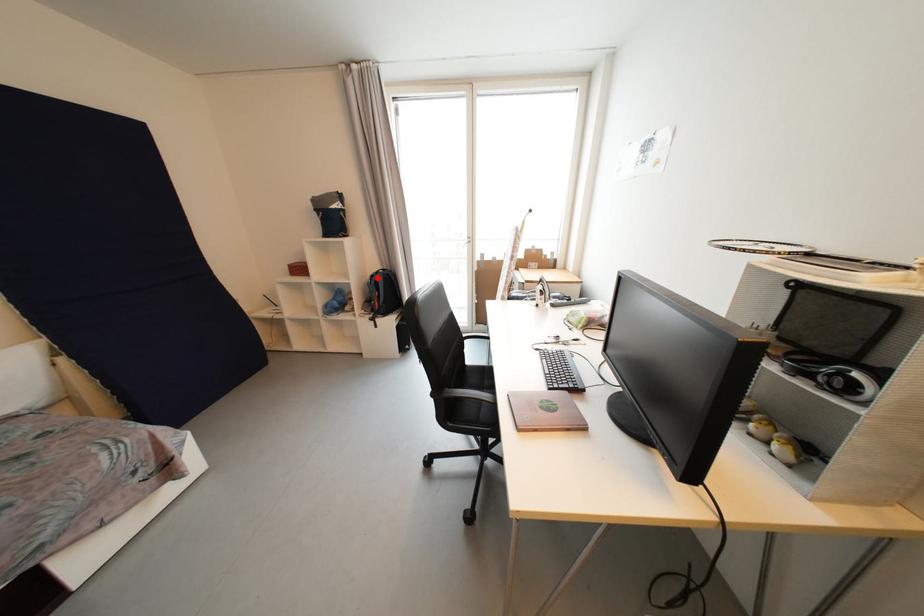
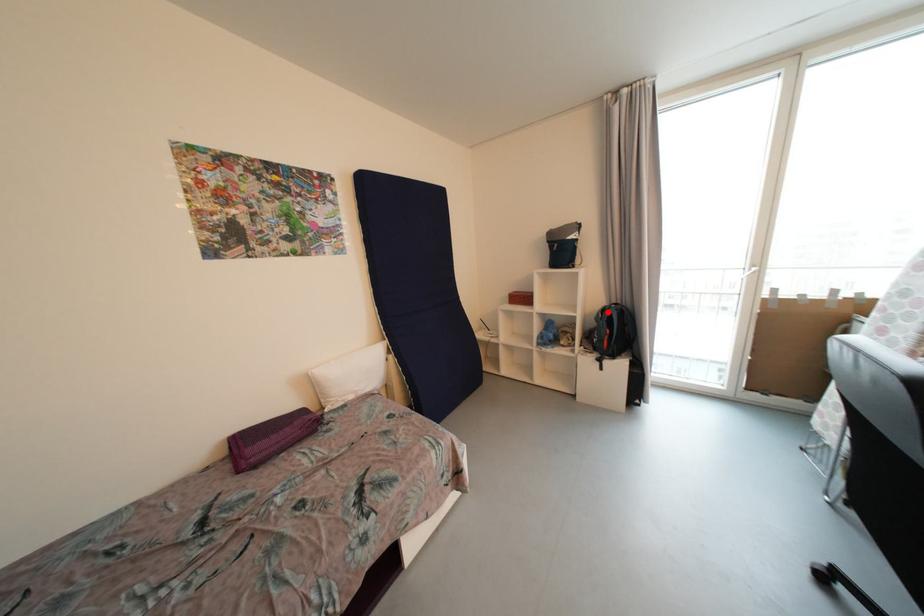
I am providing you with two images of the same scene from different viewpoints. A red point is marked on the first image and another point is marked on the second image. Does the point marked in image1 correspond to the same location as the one in image2?

Yes